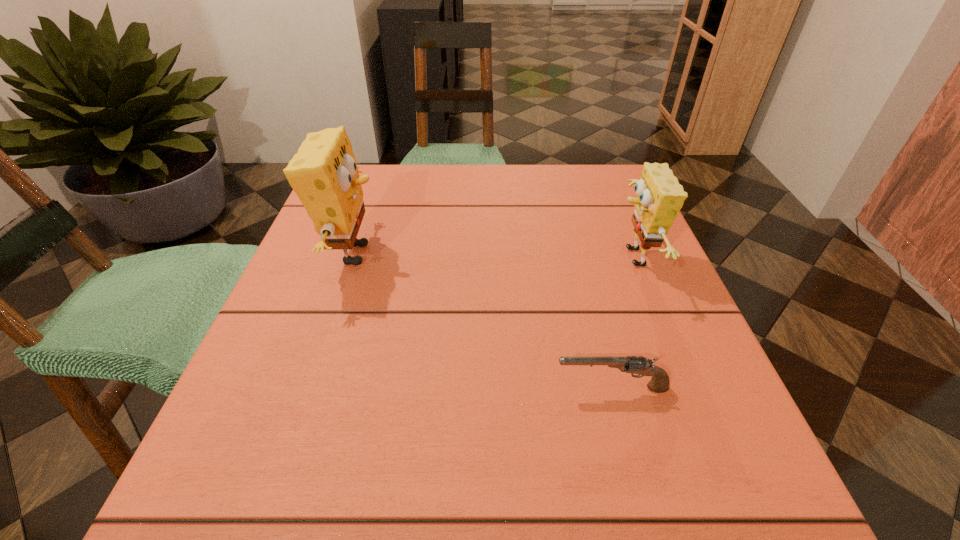
What are the coordinates of `the left sponge` in the screenshot? It's located at (324, 174).

Identify the location of the leftmost object. The image size is (960, 540). (324, 174).

This screenshot has height=540, width=960. I want to click on the right sponge, so click(x=659, y=198).

This screenshot has width=960, height=540. In order to click on the second tallest object in this screenshot , I will do `click(659, 198)`.

Find the location of `the shortest object`. the shortest object is located at coordinates (659, 383).

In order to click on the nearest object in this screenshot , I will do `click(659, 383)`.

Where is `free spot located on the face of the tallest object`? free spot located on the face of the tallest object is located at coordinates (545, 254).

The image size is (960, 540). I want to click on free region located on the face of the shorter sponge, so pyautogui.click(x=408, y=258).

Identify the location of vacant space located 0.390m on the face of the shorter sponge. This screenshot has height=540, width=960. (413, 258).

You are a GUI agent. You are given a task and a screenshot of the screen. Output one action in this format:
    pyautogui.click(x=<x>, y=<y>)
    Task: Click on the vacant space located 0.160m on the face of the shorter sponge
    
    Given the screenshot: What is the action you would take?
    (531, 258)